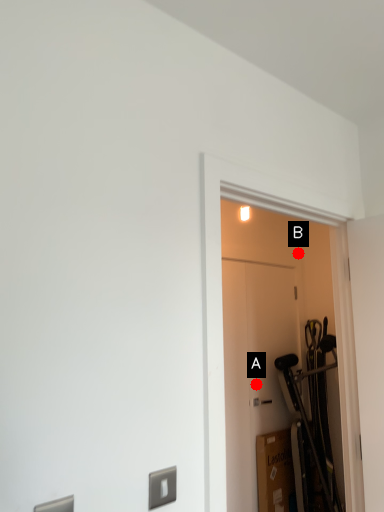
Question: Two points are circled on the image, labeled by A and B beside each circle. Which of the following is the closest to the observer?

Choices:
 (A) A is closer
 (B) B is closer

Answer: (A)